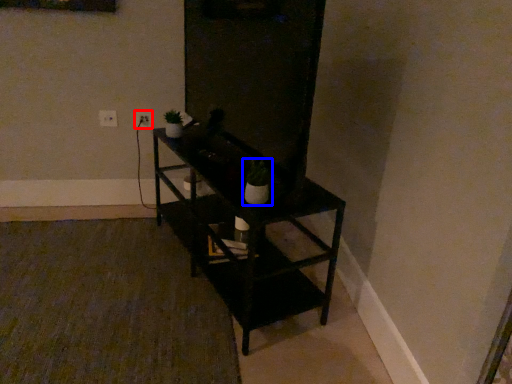
Question: Among these objects, which one is farthest to the camera, electric outlet (highlighted by a red box) or houseplant (highlighted by a blue box)?

Choices:
 (A) electric outlet
 (B) houseplant

Answer: (A)